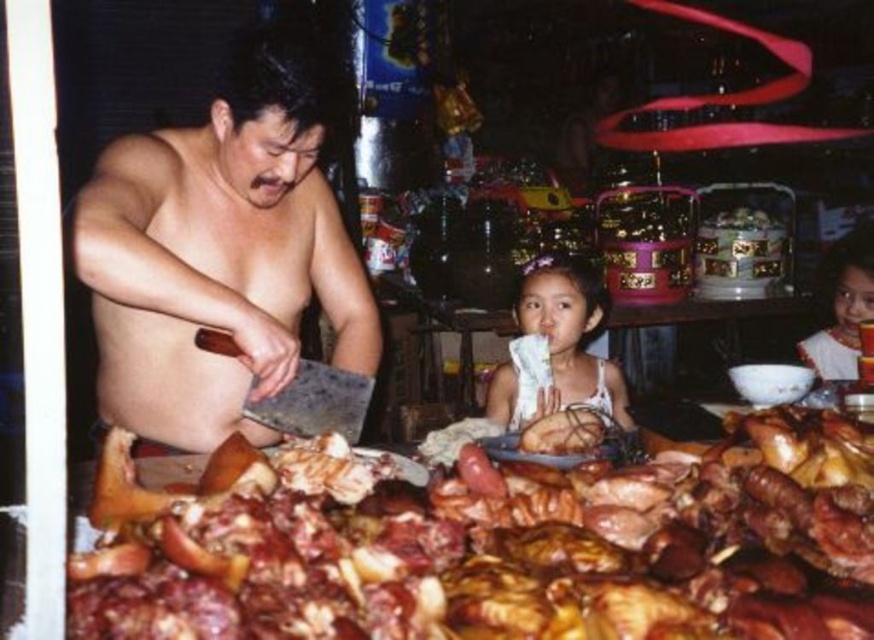
You are a customer at the food stall and want to know if the matte white dress at center is taller than the brown glossy roasted meat at center. Can you confirm?

The matte white dress at center is much taller than the brown glossy roasted meat at center according to the description.

You are a parent standing at the edge of the food stall, and you see your child wearing the white lace dress at center. The brown glossy roasted meat at center is on the table. Can you reach the roasted meat without stepping closer to the table?

The distance between the white lace dress at center and brown glossy roasted meat at center is 30.14 inches. Since the parent is at the edge of the stall, which is farther away than 30.14 inches from the meat, they cannot reach it without moving closer.